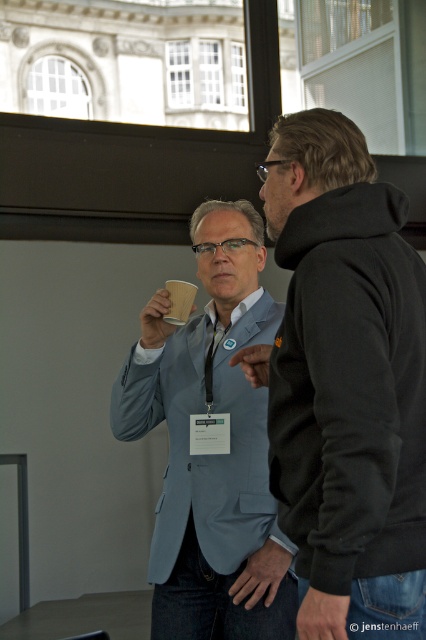
You are a delivery robot with a package that needs to be placed between the dark gray fabric hand at lower right and the brown paper cup at upper center. The minimum distance required for the package to fit is 2.5 meters. Can you place the package there?

The dark gray fabric hand at lower right is 2.72 meters away from the brown paper cup at upper center, so yes, the package can be placed there since the distance is sufficient.

You are a photographer setting up a tripod in this scene. You need to position it so that both the dark gray fabric hand at lower right and the brown paper cup at upper center are visible in the frame. Considering their positions, which object should be placed closer to the bottom of the camera frame?

The dark gray fabric hand at lower right should be placed closer to the bottom of the camera frame since it has a lesser height compared to the brown paper cup at upper center.

You are a photographer standing in the room and want to take a photo that includes both the black hoodie at right and the dark gray fabric hand at lower right. Which object should you position closer to the left side of the frame to ensure both are visible?

You should position the dark gray fabric hand at lower right closer to the left side of the frame because the black hoodie at right is already to the right of it, so moving the hand left would help balance their positions within the frame.